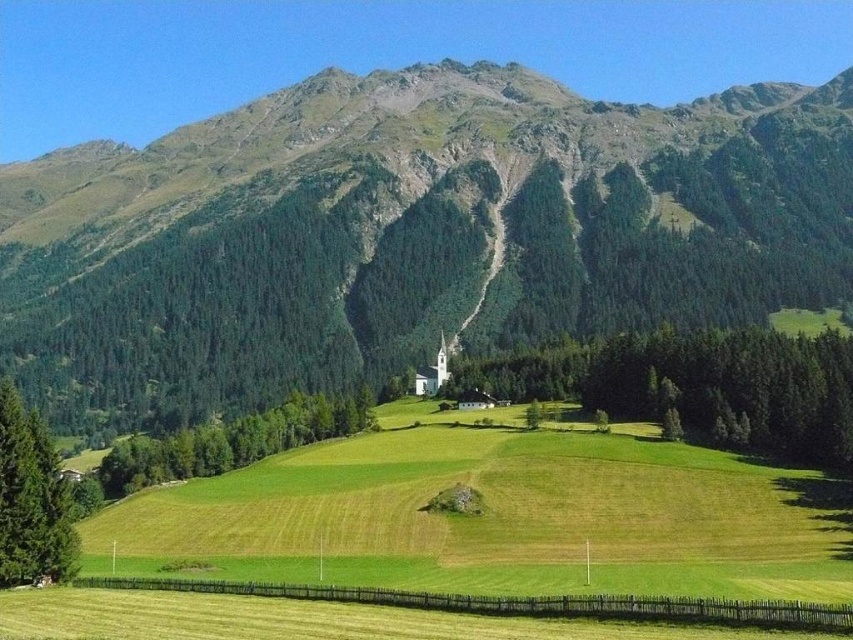
Question: Considering the relative positions of green grassy mountain at center and green grassy field at center in the image provided, where is green grassy mountain at center located with respect to green grassy field at center?

Choices:
 (A) left
 (B) right

Answer: (A)

Question: Does green grassy mountain at center appear on the right side of green grassy field at center?

Choices:
 (A) no
 (B) yes

Answer: (A)

Question: Among these objects, which one is nearest to the camera?

Choices:
 (A) green grassy field at center
 (B) green grassy mountain at center

Answer: (A)

Question: Among these points, which one is nearest to the camera?

Choices:
 (A) (94, 563)
 (B) (321, 248)

Answer: (A)

Question: Can you confirm if green grassy mountain at center is positioned to the right of green grassy field at center?

Choices:
 (A) yes
 (B) no

Answer: (B)